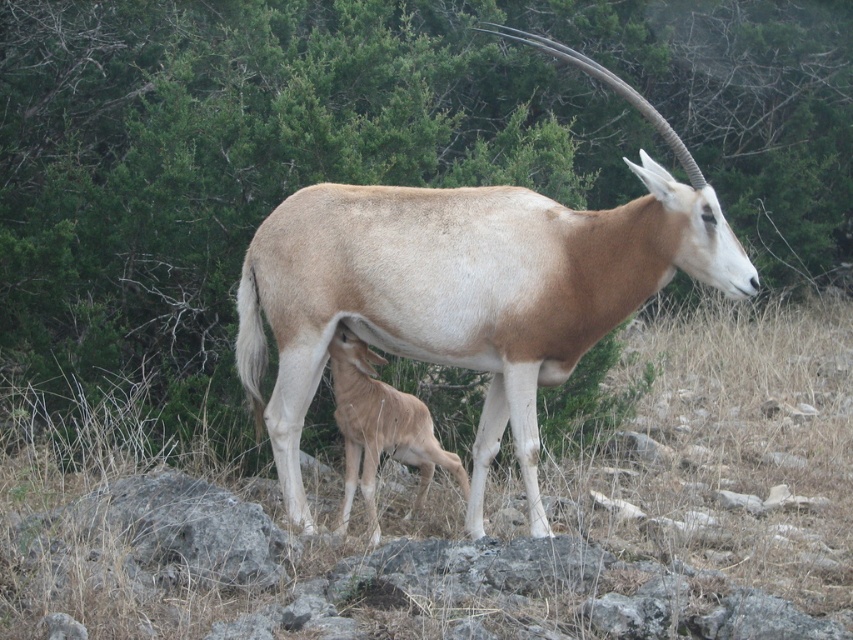
What is located at the coordinates point (485, 515) in the image?

The location at point (485, 515) contains brown dry grass at center.